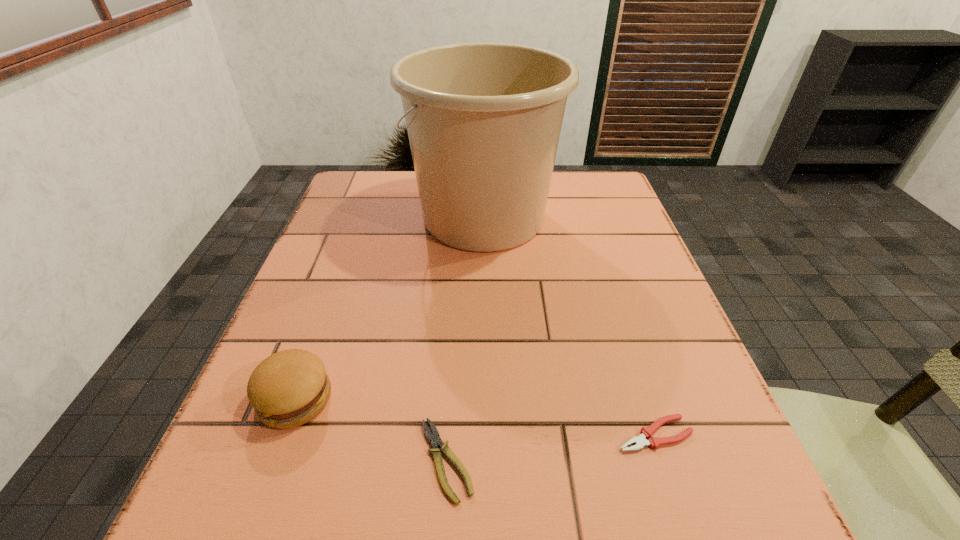
The height and width of the screenshot is (540, 960). In order to click on bucket in this screenshot , I will do `click(484, 119)`.

Identify the location of the tallest object. Image resolution: width=960 pixels, height=540 pixels. (484, 119).

This screenshot has width=960, height=540. I want to click on the third shortest object, so click(x=289, y=388).

Find the location of `hamburger`. hamburger is located at coordinates (289, 388).

This screenshot has height=540, width=960. Find the location of `the rightmost object`. the rightmost object is located at coordinates (646, 432).

Identify the location of the left pliers. The height and width of the screenshot is (540, 960). (434, 439).

Where is `vacant space located 0.330m on the front of the bucket`? The height and width of the screenshot is (540, 960). vacant space located 0.330m on the front of the bucket is located at coordinates [486, 391].

The height and width of the screenshot is (540, 960). In order to click on free region located on the back of the third shortest object in this screenshot , I will do click(x=345, y=264).

You are a GUI agent. You are given a task and a screenshot of the screen. Output one action in this format:
    pyautogui.click(x=<x>, y=<y>)
    Task: Click on the free space located on the back of the rightmost object
    This screenshot has height=540, width=960.
    Given the screenshot: What is the action you would take?
    pyautogui.click(x=633, y=366)

Where is `free location located on the back of the left pliers`? The height and width of the screenshot is (540, 960). free location located on the back of the left pliers is located at coordinates (452, 369).